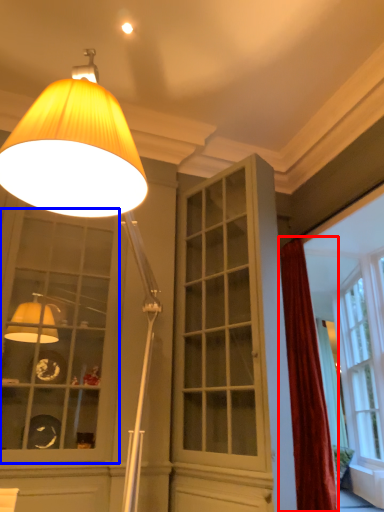
Question: Which object is closer to the camera taking this photo, curtain (highlighted by a red box) or window (highlighted by a blue box)?

Choices:
 (A) curtain
 (B) window

Answer: (B)